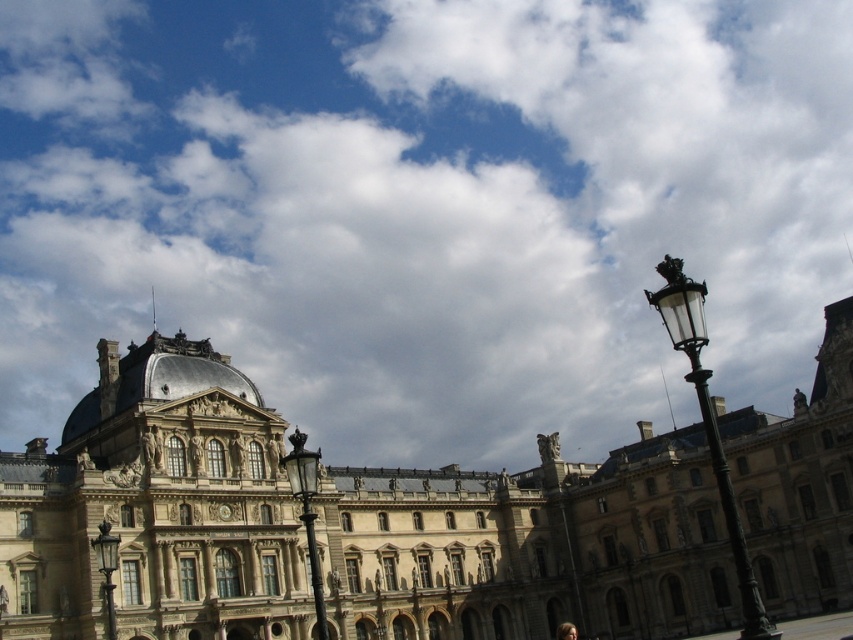
Does cloudy sky at upper center appear under golden stone palace at center?

Incorrect, cloudy sky at upper center is not positioned below golden stone palace at center.

Is cloudy sky at upper center wider than golden stone palace at center?

Indeed, cloudy sky at upper center has a greater width compared to golden stone palace at center.

Where is `cloudy sky at upper center`? Image resolution: width=853 pixels, height=640 pixels. cloudy sky at upper center is located at coordinates (422, 208).

You are a GUI agent. You are given a task and a screenshot of the screen. Output one action in this format:
    pyautogui.click(x=<x>, y=<y>)
    Task: Click on the cloudy sky at upper center
    
    Given the screenshot: What is the action you would take?
    pyautogui.click(x=422, y=208)